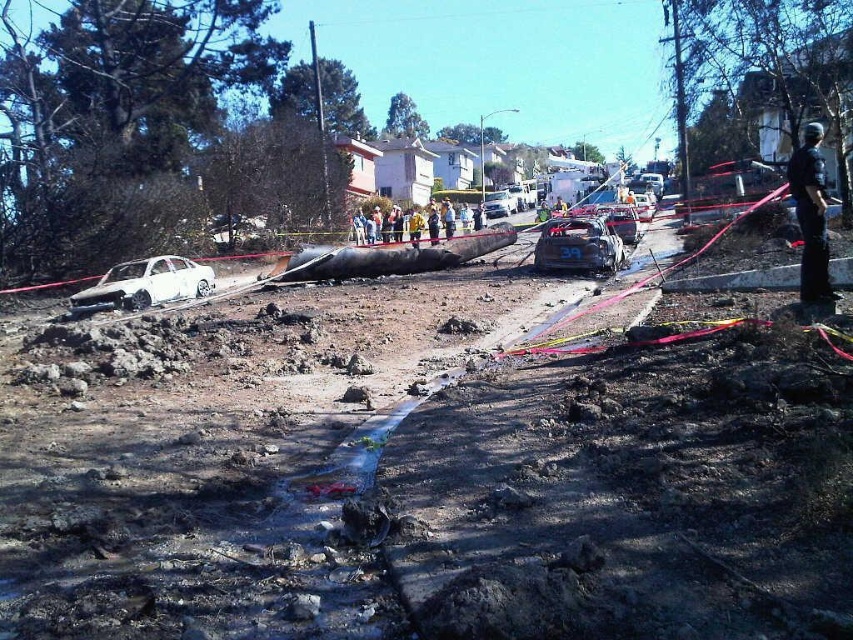
Question: Among these objects, which one is nearest to the camera?

Choices:
 (A) yellow fabric person at center
 (B) yellow uniformed person at center
 (C) white matte car at left

Answer: (C)

Question: From the image, what is the correct spatial relationship of dark blue uniform at right in relation to yellow uniformed person at center?

Choices:
 (A) right
 (B) left

Answer: (A)

Question: Which of the following is the closest to the observer?

Choices:
 (A) yellow fabric person at center
 (B) burnt metallic car at center
 (C) yellow uniformed person at center

Answer: (B)

Question: Can you confirm if burnt metallic car at center is wider than yellow uniformed person at center?

Choices:
 (A) yes
 (B) no

Answer: (B)

Question: Can you confirm if yellow uniformed person at center is positioned to the right of yellow fabric person at center?

Choices:
 (A) no
 (B) yes

Answer: (B)

Question: Among these points, which one is nearest to the camera?

Choices:
 (A) (418, 228)
 (B) (399, 240)

Answer: (B)